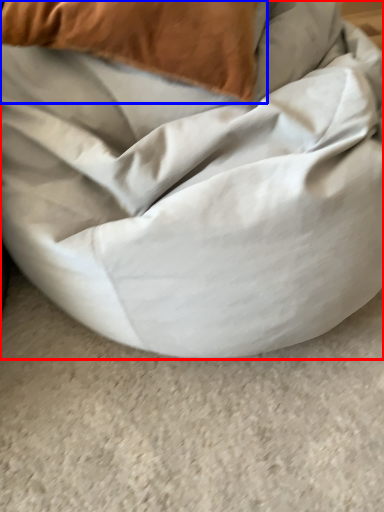
Question: Which point is closer to the camera, furniture (highlighted by a red box) or pillow (highlighted by a blue box)?

Choices:
 (A) furniture
 (B) pillow

Answer: (A)